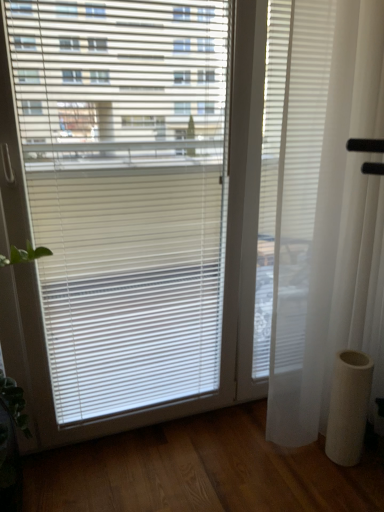
The width and height of the screenshot is (384, 512). I want to click on blank space to the left of white sheer curtain at right, so click(227, 451).